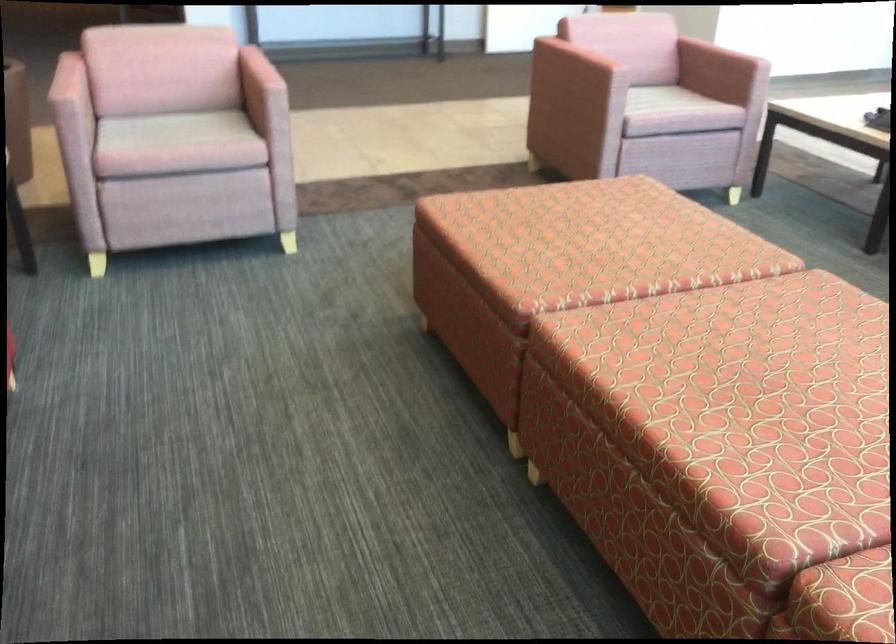
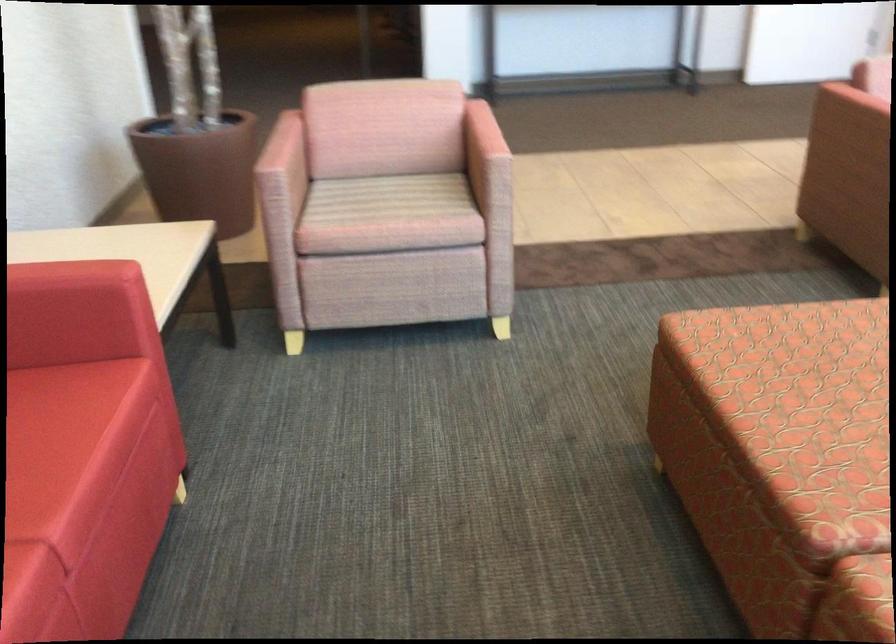
Find the pixel in the second image that matches the point at 255,69 in the first image.

(481, 133)